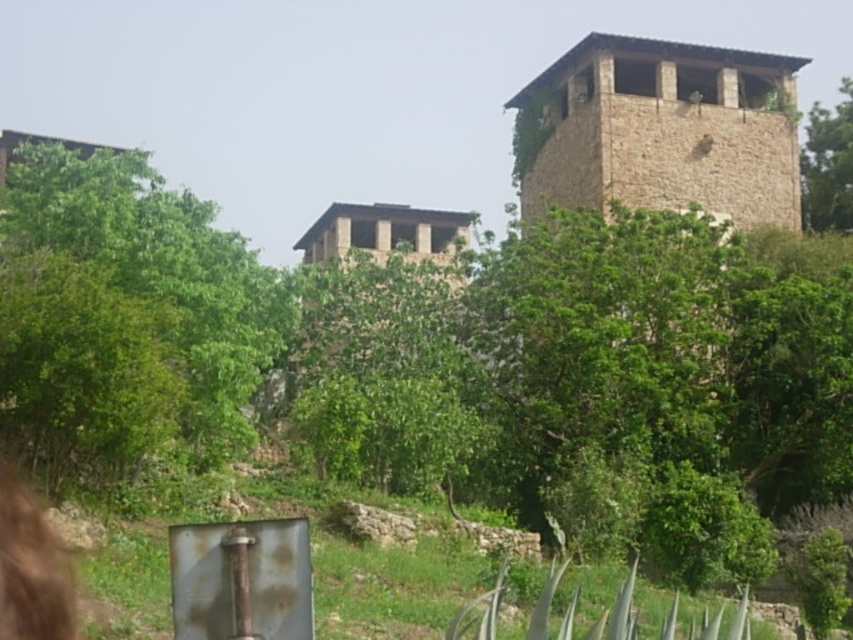
Question: Is the position of green leafy tree at left more distant than that of brown stone tower at upper right?

Choices:
 (A) yes
 (B) no

Answer: (B)

Question: Based on their relative distances, which object is farther from the brown stone tower at upper right?

Choices:
 (A) green leafy tree at upper right
 (B) green leafy tree at left

Answer: (B)

Question: Which object is farther from the camera taking this photo?

Choices:
 (A) brown stone tower at upper right
 (B) green leafy tree at upper right
 (C) green leafy tree at left

Answer: (B)

Question: Does green leafy tree at left come behind green leafy tree at upper right?

Choices:
 (A) no
 (B) yes

Answer: (A)

Question: Which object appears closest to the camera in this image?

Choices:
 (A) brown stone tower at upper right
 (B) green leafy tree at left
 (C) green leafy tree at upper right

Answer: (B)

Question: Is green leafy tree at left below brown stone tower at upper right?

Choices:
 (A) no
 (B) yes

Answer: (B)